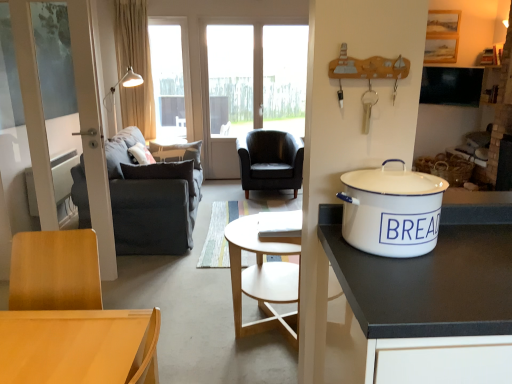
Question: Considering the relative positions of black leather chair at center and beige fabric curtain at upper left in the image provided, is black leather chair at center to the left of beige fabric curtain at upper left from the viewer's perspective?

Choices:
 (A) no
 (B) yes

Answer: (A)

Question: Is black leather chair at center positioned behind beige fabric curtain at upper left?

Choices:
 (A) yes
 (B) no

Answer: (B)

Question: Is beige fabric curtain at upper left surrounded by black leather chair at center?

Choices:
 (A) no
 (B) yes

Answer: (A)

Question: Can you confirm if black leather chair at center is thinner than beige fabric curtain at upper left?

Choices:
 (A) yes
 (B) no

Answer: (B)

Question: Does black leather chair at center have a greater width compared to beige fabric curtain at upper left?

Choices:
 (A) no
 (B) yes

Answer: (B)

Question: Does point (6, 372) appear closer or farther from the camera than point (192, 172)?

Choices:
 (A) closer
 (B) farther

Answer: (A)

Question: Is light brown wood desk at lower left inside the boundaries of dark gray fabric couch at left, or outside?

Choices:
 (A) outside
 (B) inside

Answer: (A)

Question: Looking at their shapes, would you say light brown wood desk at lower left is wider or thinner than dark gray fabric couch at left?

Choices:
 (A) wide
 (B) thin

Answer: (B)

Question: Considering their positions, is light brown wood desk at lower left located in front of or behind dark gray fabric couch at left?

Choices:
 (A) behind
 (B) front

Answer: (B)

Question: Is beige fabric curtain at upper left bigger or smaller than transparent glass window at upper center?

Choices:
 (A) big
 (B) small

Answer: (A)

Question: From a real-world perspective, is beige fabric curtain at upper left positioned above or below transparent glass window at upper center?

Choices:
 (A) above
 (B) below

Answer: (A)

Question: Is beige fabric curtain at upper left taller or shorter than transparent glass window at upper center?

Choices:
 (A) short
 (B) tall

Answer: (B)

Question: Is beige fabric curtain at upper left inside or outside of transparent glass window at upper center?

Choices:
 (A) inside
 (B) outside

Answer: (B)

Question: Considering the positions of point (115, 188) and point (437, 221), is point (115, 188) closer or farther from the camera than point (437, 221)?

Choices:
 (A) closer
 (B) farther

Answer: (B)

Question: Choose the correct answer: Is dark gray fabric couch at left inside white enamel bread bin at right or outside it?

Choices:
 (A) inside
 (B) outside

Answer: (B)